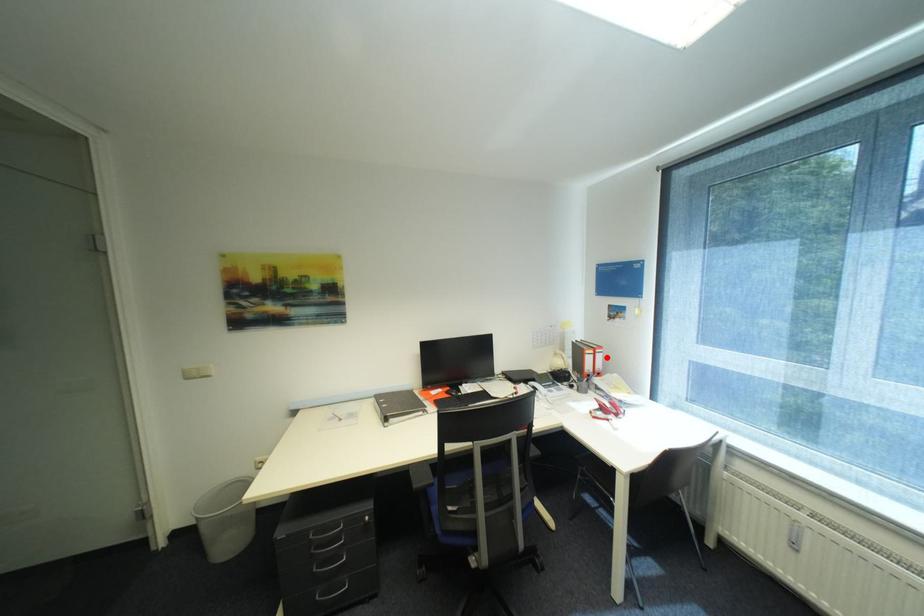
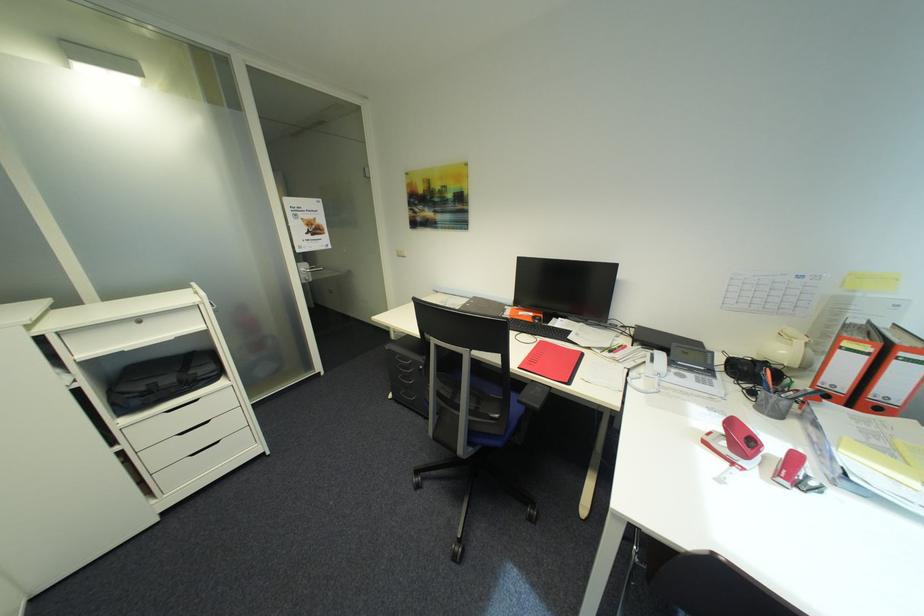
The point at the highlighted location is marked in the first image. Where is the corresponding point in the second image?

(912, 371)